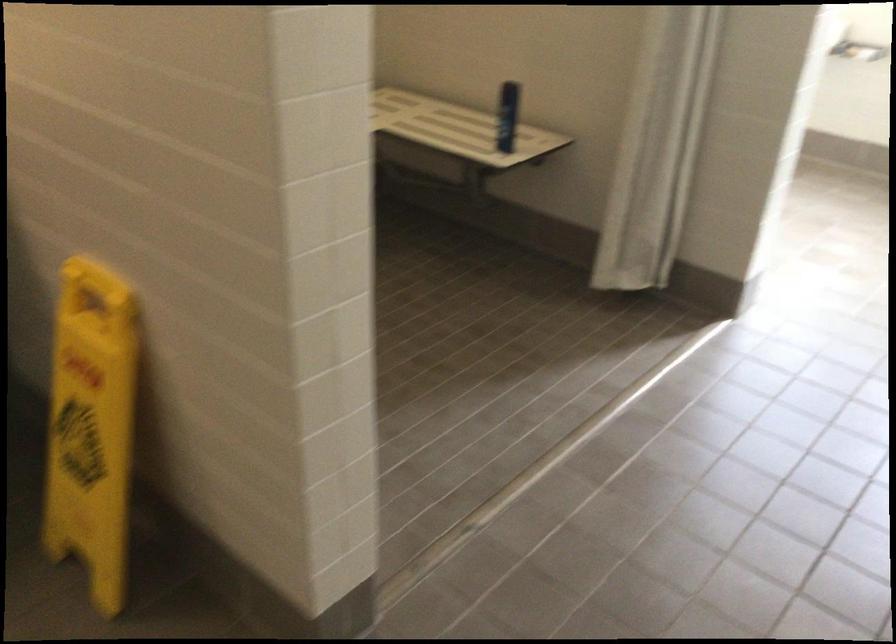
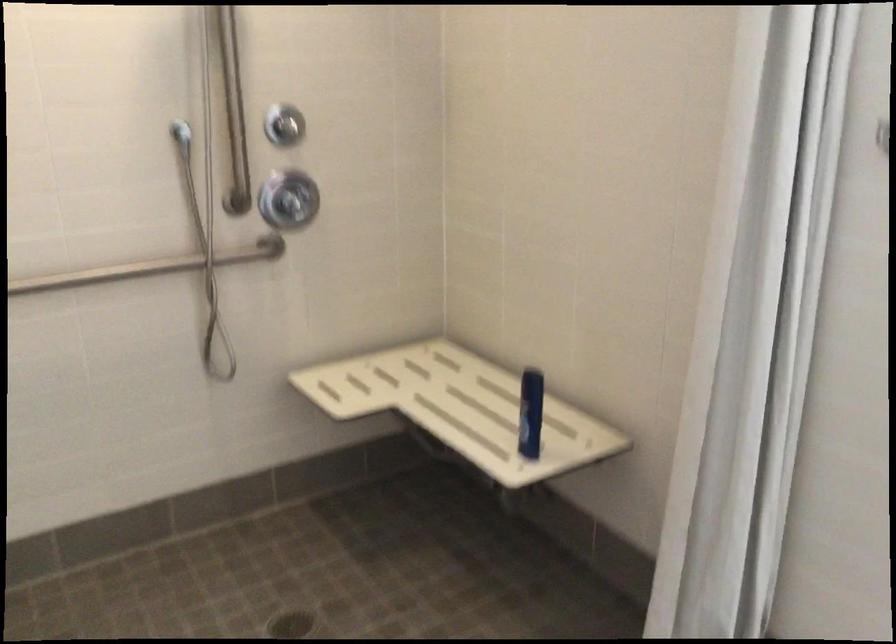
In the second image, find the point that corresponds to (x=434, y=131) in the first image.

(460, 408)